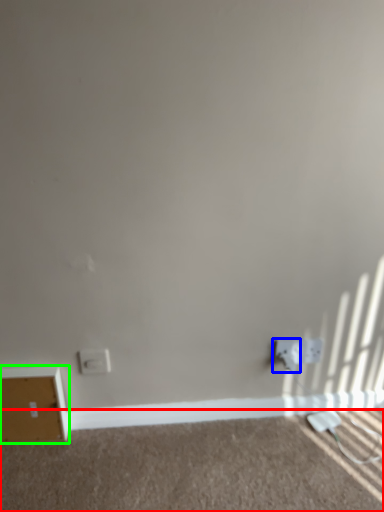
Question: Which object is positioned farthest from plain (highlighted by a red box)? Select from electric outlet (highlighted by a blue box) and file cabinet (highlighted by a green box).

Choices:
 (A) electric outlet
 (B) file cabinet

Answer: (A)